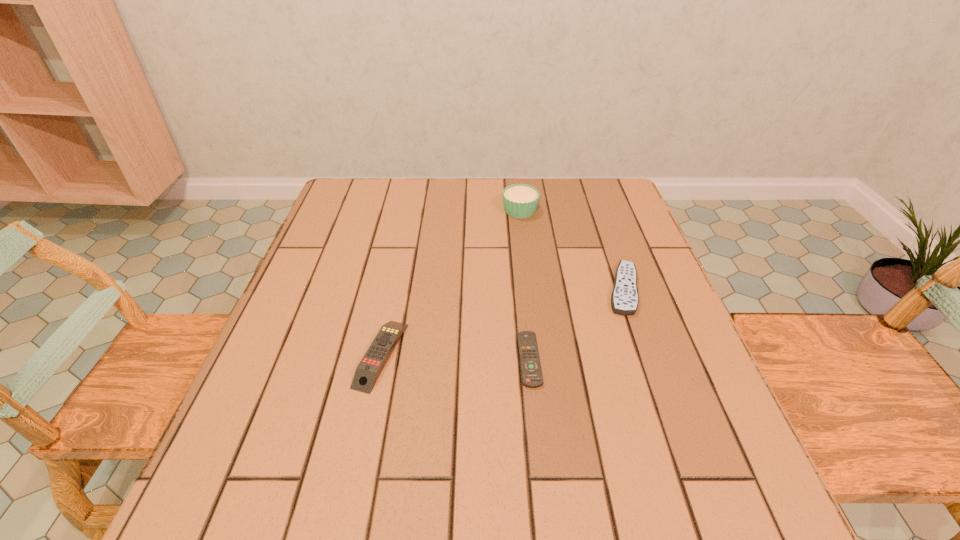
You are a GUI agent. You are given a task and a screenshot of the screen. Output one action in this format:
    pyautogui.click(x=<x>, y=<y>)
    Task: Click on the free location located 0.150m on the left of the shortest remote control
    
    Given the screenshot: What is the action you would take?
    pyautogui.click(x=442, y=360)

The image size is (960, 540). What are the coordinates of `object situated at the far edge` in the screenshot? It's located at (520, 201).

Identify the location of object that is at the right edge. This screenshot has width=960, height=540. (624, 299).

The height and width of the screenshot is (540, 960). Identify the location of vacant space at the far edge of the desktop. (437, 181).

Find the location of a particular element. vacant space at the near edge is located at coordinates (x=655, y=505).

Find the location of a particular element. free space at the left edge is located at coordinates (329, 283).

Where is `free region at the right edge`? This screenshot has width=960, height=540. free region at the right edge is located at coordinates (588, 226).

At what (x,y) coordinates should I click in order to perform the action: click on vacant space at the near left corner of the desktop. Please return your answer as a coordinate pair (x, y). This screenshot has width=960, height=540. Looking at the image, I should click on (242, 505).

Identify the location of vacant space at the far right corner. The height and width of the screenshot is (540, 960). (616, 219).

The image size is (960, 540). Identify the location of vacant space in between the farthest object and the rightmost object. (571, 249).